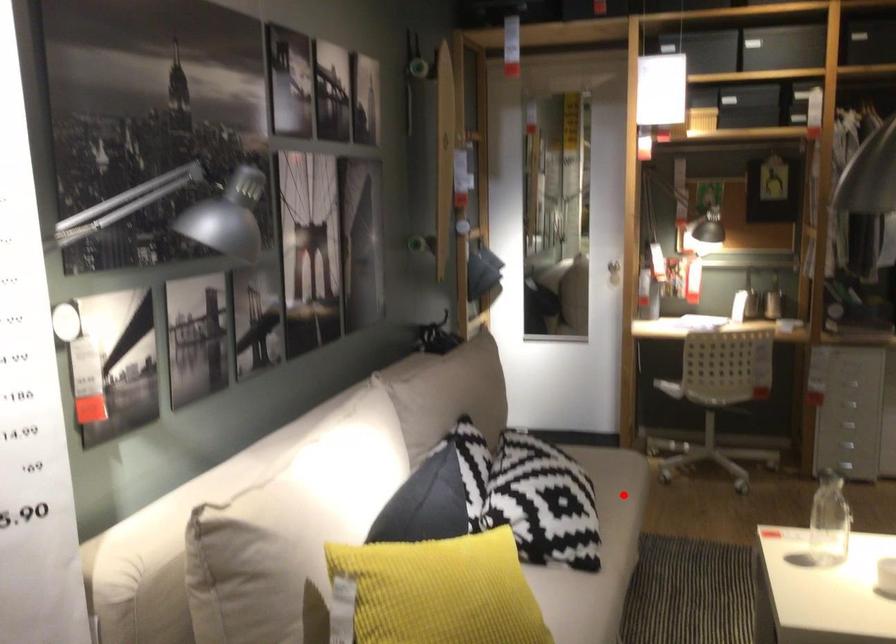
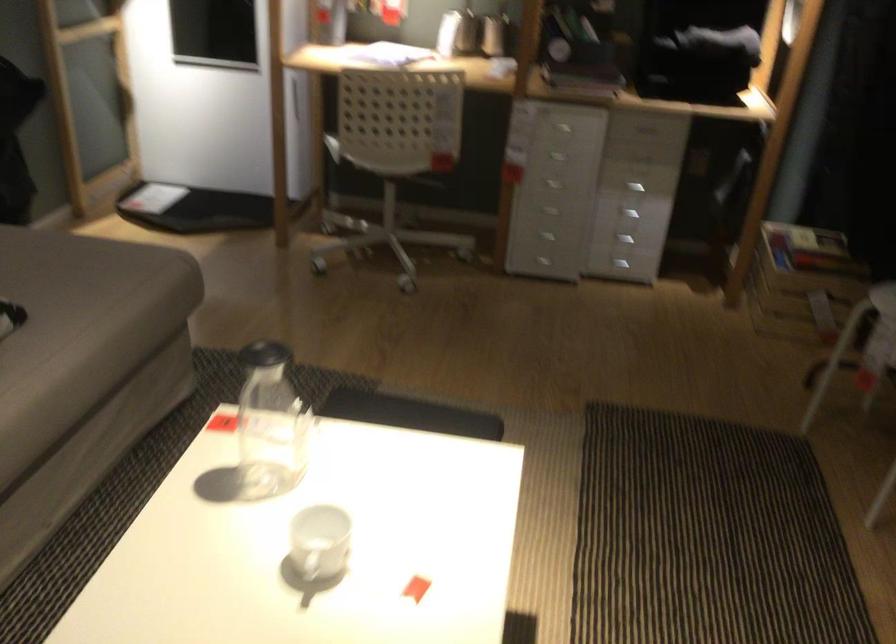
Find the pixel in the second image that matches the highlighted location in the first image.

(82, 324)